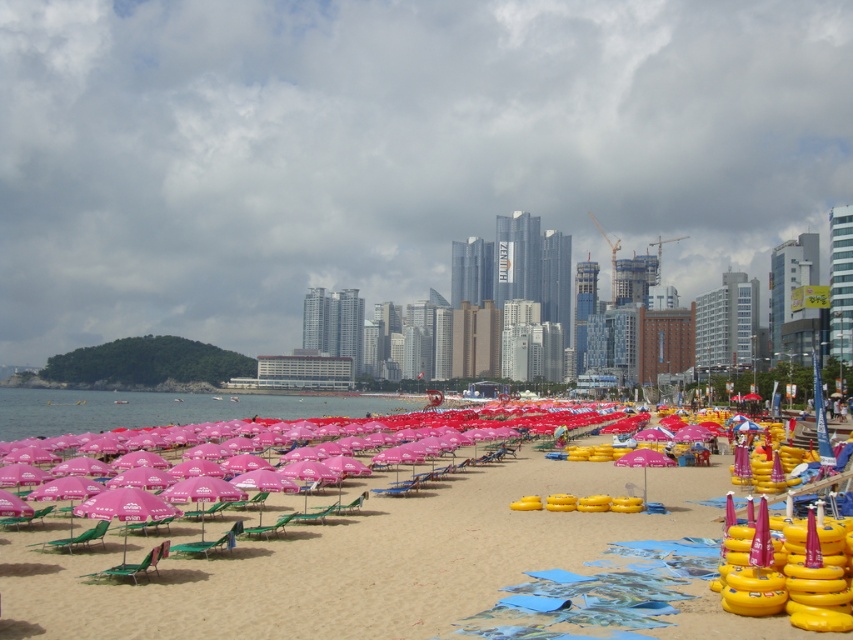
You are standing at the point labeled as point (360, 560) in the image. Which direction should you walk to reach the sandy beach at center?

The point labeled as point (360, 560) is already located at the sandy beach at center, so you are already there.

You are planning to set up a small food stand on the beach. The sandy beach at center is narrower than the transparent water at center. Which area would be more suitable for placing your stand to ensure it stays dry during high tide?

The sandy beach at center is narrower than the transparent water at center, so placing the food stand on the sandy beach at center would be more suitable as it is less likely to be submerged during high tide since it has a smaller width compared to the water area.